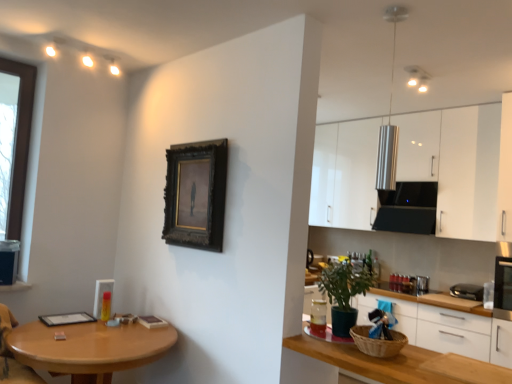
Find the location of a particular element. This screenshot has height=384, width=512. black plastic toaster at right is located at coordinates (467, 291).

Describe the element at coordinates (196, 194) in the screenshot. The image size is (512, 384). I see `dark wood picture frame at center` at that location.

What is the approximate height of white glossy drawer at lower right?

white glossy drawer at lower right is 4.52 inches in height.

Image resolution: width=512 pixels, height=384 pixels. I want to click on green matte plant at lower right, so click(345, 291).

Starting from the white glossy drawer at lower right, which cabinetry is the 2nd one behind? Please provide its 2D coordinates.

[(455, 165)]

Does white glossy drawer at lower right appear on the right side of white glossy cabinets at upper right, the first cabinetry in the top-to-bottom sequence?

No.

Who is bigger, white glossy drawer at lower right or white glossy cabinets at upper right, positioned as the second cabinetry in bottom-to-top order?

With larger size is white glossy cabinets at upper right, positioned as the second cabinetry in bottom-to-top order.

Does white glossy drawer at lower right have a lesser height compared to white glossy cabinets at upper right, the first cabinetry in the top-to-bottom sequence?

→ Yes.

Between point (383, 381) and point (194, 182), which one is positioned in front?

The point (383, 381) is in front.

Based on the photo, is white glossy cabinets at right, which appears as the 2th cabinetry when viewed from the top, at the left side of dark wood picture frame at center?

No, white glossy cabinets at right, which appears as the 2th cabinetry when viewed from the top, is not to the left of dark wood picture frame at center.

Is white glossy cabinets at right, which is the first cabinetry in bottom-to-top order, directly adjacent to dark wood picture frame at center?

white glossy cabinets at right, which is the first cabinetry in bottom-to-top order, is not next to dark wood picture frame at center, and they're not touching.

Image resolution: width=512 pixels, height=384 pixels. I want to click on cabinetry below the dark wood picture frame at center (from the image's perspective), so click(x=436, y=323).

Is white glossy drawer at lower right in contact with green matte plant at lower right?

white glossy drawer at lower right and green matte plant at lower right are clearly separated.

Looking at this image, is white glossy drawer at lower right shorter than green matte plant at lower right?

Yes.

Which is more to the right, white glossy drawer at lower right or green matte plant at lower right?

From the viewer's perspective, white glossy drawer at lower right appears more on the right side.

Considering the relative sizes of wooden table at lower left and green matte plant at lower right in the image provided, is wooden table at lower left bigger than green matte plant at lower right?

Indeed, wooden table at lower left has a larger size compared to green matte plant at lower right.

Is wooden table at lower left inside the boundaries of green matte plant at lower right, or outside?

wooden table at lower left exists outside the volume of green matte plant at lower right.

Would you consider wooden table at lower left to be distant from green matte plant at lower right?

Yes, wooden table at lower left and green matte plant at lower right are quite far apart.

Considering the relative sizes of wooden table at lower left and green matte plant at lower right in the image provided, is wooden table at lower left shorter than green matte plant at lower right?

In fact, wooden table at lower left may be taller than green matte plant at lower right.

From a real-world perspective, does white glossy cabinets at right, which appears as the 2th cabinetry when viewed from the top, sit lower than white glossy cabinets at upper right, the first cabinetry in the top-to-bottom sequence?

Yes, from a real-world perspective, white glossy cabinets at right, which appears as the 2th cabinetry when viewed from the top, is below white glossy cabinets at upper right, the first cabinetry in the top-to-bottom sequence.

Measure the distance from white glossy cabinets at right, which is the first cabinetry in bottom-to-top order, to white glossy cabinets at upper right, the first cabinetry in the top-to-bottom sequence.

white glossy cabinets at right, which is the first cabinetry in bottom-to-top order, is 1.09 meters away from white glossy cabinets at upper right, the first cabinetry in the top-to-bottom sequence.

At what (x,y) coordinates should I click in order to perform the action: click on cabinetry below the white glossy cabinets at upper right, positioned as the second cabinetry in bottom-to-top order (from the image's perspective). Please return your answer as a coordinate pair (x, y). This screenshot has width=512, height=384. Looking at the image, I should click on (436, 323).

Does point (486, 322) come farther from viewer compared to point (321, 163)?

No.

From the image's perspective, which one is positioned higher, white glossy cabinets at right, which is the first cabinetry in bottom-to-top order, or green matte plant at lower right?

From the image's view, green matte plant at lower right is above.

Is white glossy cabinets at right, which is the first cabinetry in bottom-to-top order, surrounding green matte plant at lower right?

No, green matte plant at lower right is not a part of white glossy cabinets at right, which is the first cabinetry in bottom-to-top order.

Which of these two, white glossy cabinets at right, which appears as the 2th cabinetry when viewed from the top, or green matte plant at lower right, is smaller?

Smaller between the two is green matte plant at lower right.

This screenshot has height=384, width=512. What are the coordinates of `cabinetry above the white glossy drawer at lower right (from the image's perspective)` in the screenshot? It's located at (x=455, y=165).

Considering the points (334, 143) and (370, 309), which point is in front, point (334, 143) or point (370, 309)?

The point (370, 309) is more forward.

Considering the positions of objects white glossy cabinets at upper right, the first cabinetry in the top-to-bottom sequence, and white glossy drawer at lower right in the image provided, who is behind, white glossy cabinets at upper right, the first cabinetry in the top-to-bottom sequence, or white glossy drawer at lower right?

white glossy cabinets at upper right, the first cabinetry in the top-to-bottom sequence, is more distant.

In the scene shown: Measure the distance from white glossy cabinets at upper right, positioned as the second cabinetry in bottom-to-top order, to white glossy drawer at lower right.

A distance of 3.95 feet exists between white glossy cabinets at upper right, positioned as the second cabinetry in bottom-to-top order, and white glossy drawer at lower right.

At what (x,y) coordinates should I click in order to perform the action: click on cabinetry that is above the white glossy drawer at lower right (from the image's perspective). Please return your answer as a coordinate pair (x, y). The height and width of the screenshot is (384, 512). Looking at the image, I should click on (455, 165).

Where is `picture frame that appears in front of the white glossy cabinets at right, which appears as the 2th cabinetry when viewed from the top`? picture frame that appears in front of the white glossy cabinets at right, which appears as the 2th cabinetry when viewed from the top is located at coordinates (196, 194).

Estimate the real-world distances between objects in this image. Which object is further from white glossy drawer at lower right, white glossy cabinets at right, which appears as the 2th cabinetry when viewed from the top, or black plastic toaster at right?

The object further to white glossy drawer at lower right is black plastic toaster at right.

In the scene shown: Estimate the real-world distances between objects in this image. Which object is closer to white glossy cabinets at right, which appears as the 2th cabinetry when viewed from the top, white glossy cabinets at upper right, positioned as the second cabinetry in bottom-to-top order, or dark wood picture frame at center?

white glossy cabinets at upper right, positioned as the second cabinetry in bottom-to-top order, lies closer to white glossy cabinets at right, which appears as the 2th cabinetry when viewed from the top, than the other object.

Looking at the image, which one is located closer to white glossy drawer at lower right, white glossy cabinets at right, which appears as the 2th cabinetry when viewed from the top, or white glossy cabinets at upper right, positioned as the second cabinetry in bottom-to-top order?

The object closer to white glossy drawer at lower right is white glossy cabinets at right, which appears as the 2th cabinetry when viewed from the top.

Estimate the real-world distances between objects in this image. Which object is closer to green matte plant at lower right, dark wood picture frame at center or white glossy drawer at lower right?

dark wood picture frame at center is closer to green matte plant at lower right.

Looking at the image, which one is located further to green matte plant at lower right, white glossy cabinets at upper right, the first cabinetry in the top-to-bottom sequence, or dark wood picture frame at center?

white glossy cabinets at upper right, the first cabinetry in the top-to-bottom sequence, lies further to green matte plant at lower right than the other object.

Which object lies further to the anchor point white glossy drawer at lower right, green matte plant at lower right or dark wood picture frame at center?

Among the two, dark wood picture frame at center is located further to white glossy drawer at lower right.

Based on their spatial positions, is white glossy cabinets at right, which is the first cabinetry in bottom-to-top order, or dark wood picture frame at center further from white glossy drawer at lower right?

dark wood picture frame at center lies further to white glossy drawer at lower right than the other object.

Looking at the image, which one is located closer to black plastic toaster at right, white glossy drawer at lower right or white glossy cabinets at right, which is the first cabinetry in bottom-to-top order?

white glossy cabinets at right, which is the first cabinetry in bottom-to-top order, is positioned closer to the anchor black plastic toaster at right.

At what (x,y) coordinates should I click in order to perform the action: click on houseplant located between dark wood picture frame at center and white glossy drawer at lower right in the left-right direction. Please return your answer as a coordinate pair (x, y). Image resolution: width=512 pixels, height=384 pixels. Looking at the image, I should click on (345, 291).

This screenshot has height=384, width=512. I want to click on houseplant located between wooden table at lower left and white glossy cabinets at upper right, the first cabinetry in the top-to-bottom sequence, in the left-right direction, so click(345, 291).

Locate an element on the screen. houseplant between wooden table at lower left and white glossy cabinets at right, which appears as the 2th cabinetry when viewed from the top, in the horizontal direction is located at coordinates (345, 291).

The height and width of the screenshot is (384, 512). I want to click on houseplant between wooden table at lower left and black plastic toaster at right, so click(345, 291).